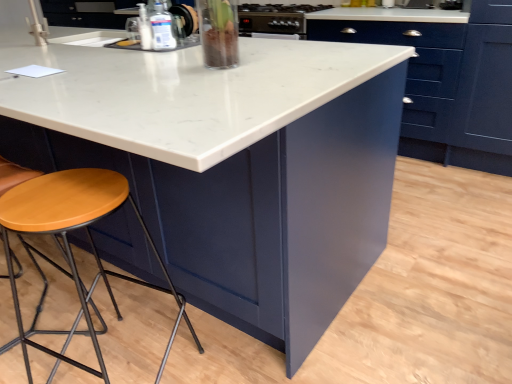
Question: Which direction should I rotate to face clear glass vase at upper center, the first appliance from the front, — up or down?

Choices:
 (A) up
 (B) down

Answer: (A)

Question: From a real-world perspective, is wooden seat stool at lower left below wooden seat at lower left?

Choices:
 (A) no
 (B) yes

Answer: (B)

Question: Is wooden seat stool at lower left next to wooden seat at lower left?

Choices:
 (A) no
 (B) yes

Answer: (A)

Question: Considering the relative sizes of wooden seat stool at lower left and wooden seat at lower left in the image provided, is wooden seat stool at lower left wider than wooden seat at lower left?

Choices:
 (A) no
 (B) yes

Answer: (B)

Question: Can you confirm if wooden seat stool at lower left is positioned to the right of wooden seat at lower left?

Choices:
 (A) no
 (B) yes

Answer: (B)

Question: Is wooden seat stool at lower left in front of wooden seat at lower left?

Choices:
 (A) yes
 (B) no

Answer: (A)

Question: From the image's perspective, is wooden seat stool at lower left under wooden seat at lower left?

Choices:
 (A) yes
 (B) no

Answer: (A)

Question: Does wooden seat at lower left have a larger size compared to wooden seat stool at lower left?

Choices:
 (A) yes
 (B) no

Answer: (A)

Question: From the image's perspective, is wooden seat at lower left located above wooden seat stool at lower left?

Choices:
 (A) yes
 (B) no

Answer: (A)

Question: From a real-world perspective, is wooden seat at lower left over wooden seat stool at lower left?

Choices:
 (A) yes
 (B) no

Answer: (A)

Question: Can you confirm if wooden seat at lower left is wider than wooden seat stool at lower left?

Choices:
 (A) yes
 (B) no

Answer: (B)

Question: Would you say wooden seat stool at lower left is part of wooden seat at lower left's contents?

Choices:
 (A) yes
 (B) no

Answer: (B)

Question: Does wooden seat at lower left have a lesser width compared to wooden seat stool at lower left?

Choices:
 (A) yes
 (B) no

Answer: (A)

Question: Considering the relative sizes of clear glass vase at upper center, the first appliance from the front, and wooden seat at lower left in the image provided, is clear glass vase at upper center, the first appliance from the front, thinner than wooden seat at lower left?

Choices:
 (A) no
 (B) yes

Answer: (B)